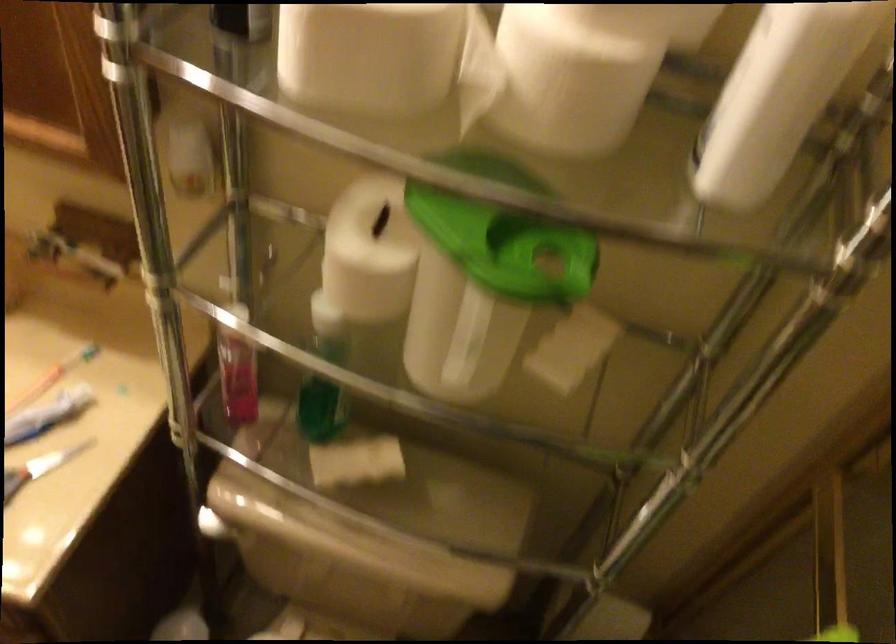
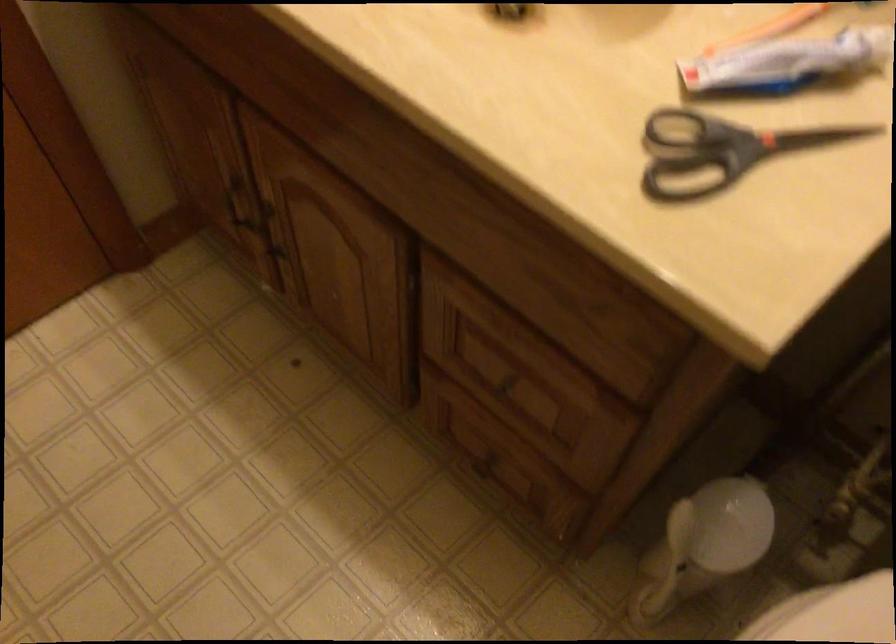
What movement of the cameraman would produce the second image?

The cameraman moved toward left, forward.